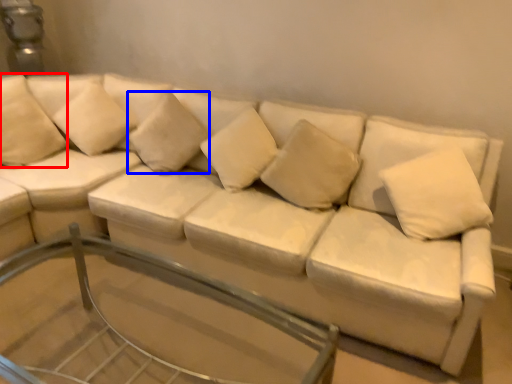
Question: Among these objects, which one is farthest to the camera, pillow (highlighted by a red box) or pillow (highlighted by a blue box)?

Choices:
 (A) pillow
 (B) pillow

Answer: (A)